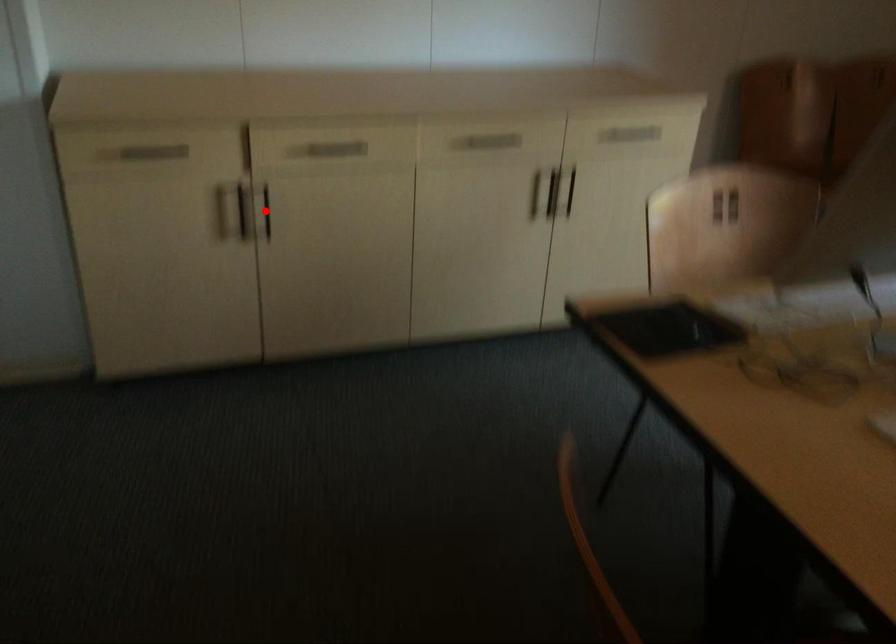
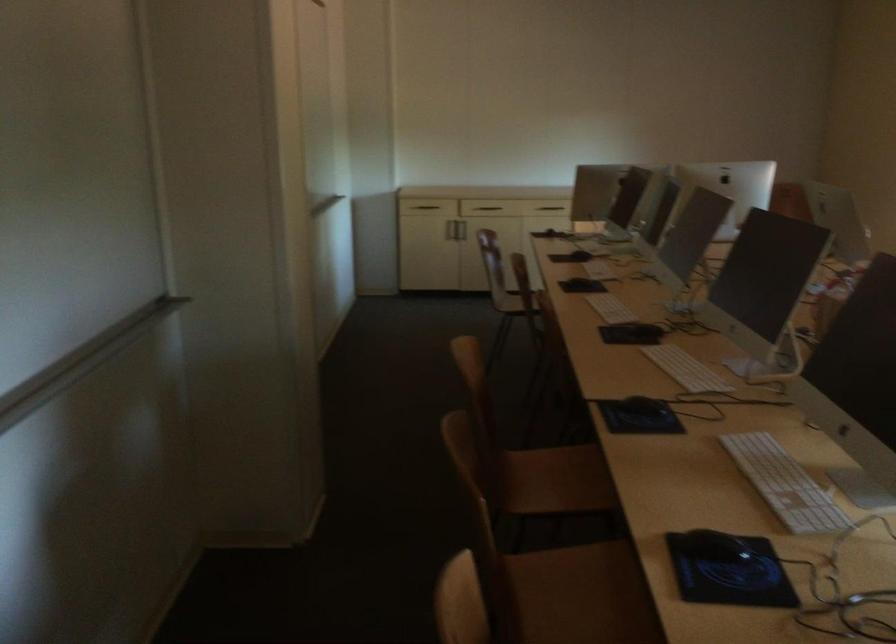
Question: I am providing you with two images of the same scene from different viewpoints. Image1 has a red point marked. In image2, the corresponding 3D location appears at what relative position? Reply with the corresponding letter.

Choices:
 (A) Closer
 (B) Farther

Answer: (B)